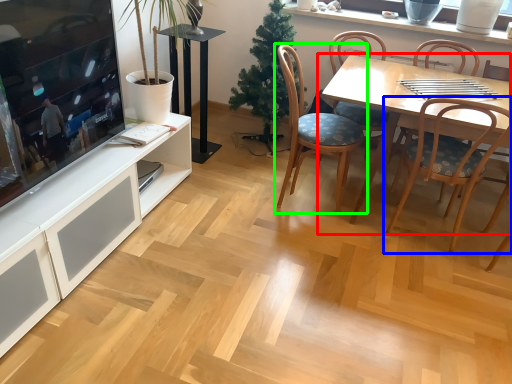
Question: Which object is positioned farthest from kitchen & dining room table (highlighted by a red box)? Select from chair (highlighted by a blue box) and chair (highlighted by a green box).

Choices:
 (A) chair
 (B) chair

Answer: (B)